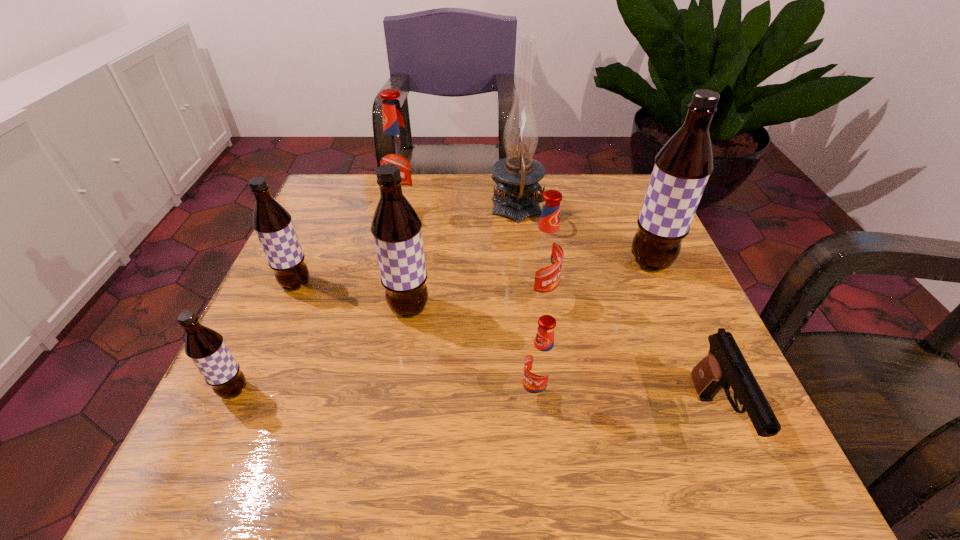
You are a GUI agent. You are given a task and a screenshot of the screen. Output one action in this format:
    pyautogui.click(x=<x>, y=<y>)
    Task: Click on the vacant region between the leftmost red root beer and the biggest brown root beer
    The image size is (960, 540).
    Given the screenshot: What is the action you would take?
    pyautogui.click(x=528, y=239)

Find the location of a particular element. empty space that is in between the shortest object and the rightmost brown root beer is located at coordinates (683, 341).

This screenshot has height=540, width=960. I want to click on object that ranks as the third closest to the smallest red root beer, so click(724, 366).

Where is `the fourth closest object to the oil lamp`? This screenshot has width=960, height=540. the fourth closest object to the oil lamp is located at coordinates (396, 227).

Identify the location of root beer that is the fourth closest one to the second smallest red root beer. (396, 149).

The width and height of the screenshot is (960, 540). Identify the location of root beer object that ranks as the third closest to the rightmost root beer. (396, 227).

Find the location of a particular element. Image resolution: width=960 pixels, height=540 pixels. brown root beer object that ranks as the second closest to the second smallest brown root beer is located at coordinates (206, 348).

Point out which brown root beer is positioned as the second nearest to the third biggest brown root beer. Please provide its 2D coordinates. Your answer should be formatted as a tuple, i.e. [(x, y)], where the tuple contains the x and y coordinates of a point satisfying the conditions above.

[(206, 348)]

In order to click on red root beer that stands as the third closest to the third brown root beer from left to right in this screenshot , I will do (x=396, y=149).

Choose which red root beer is the nearest neighbor to the third brown root beer from left to right. Please provide its 2D coordinates. Your answer should be formatted as a tuple, i.e. [(x, y)], where the tuple contains the x and y coordinates of a point satisfying the conditions above.

[(545, 251)]